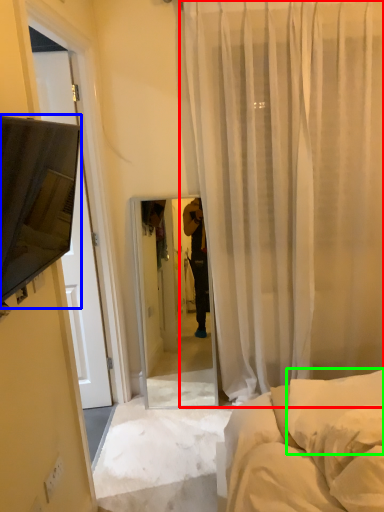
Question: Which object is positioned closest to curtain (highlighted by a red box)? Select from canopy bed (highlighted by a blue box) and pillow (highlighted by a green box).

Choices:
 (A) canopy bed
 (B) pillow

Answer: (B)